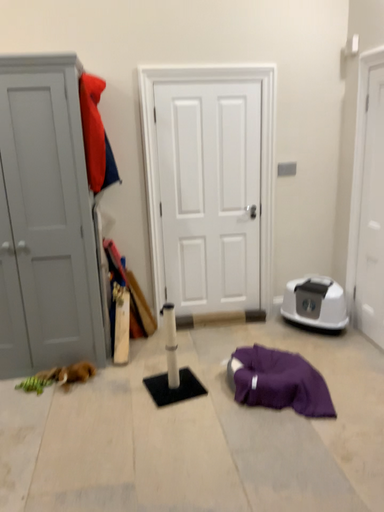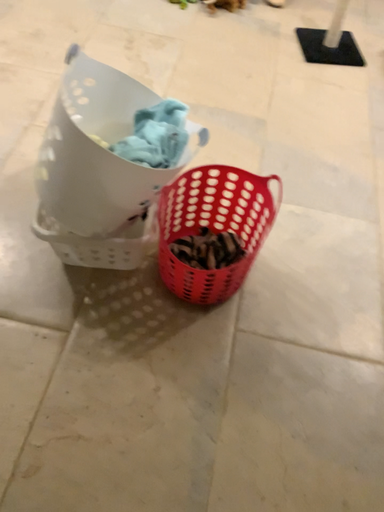
Question: Which way did the camera rotate in the video?

Choices:
 (A) rotated right
 (B) rotated left

Answer: (B)